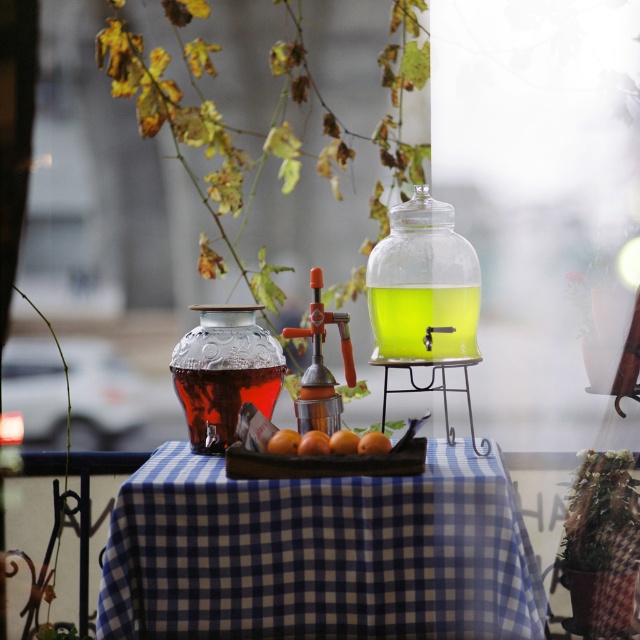
Which is above, blue checkered tablecloth at center or orange matte at center?

orange matte at center

Find the location of a particular element. The image size is (640, 640). blue checkered tablecloth at center is located at coordinates (320, 554).

Does blue checkered tablecloth at center come in front of translucent glass jug at center?

Yes, blue checkered tablecloth at center is in front of translucent glass jug at center.

What do you see at coordinates (320, 554) in the screenshot? I see `blue checkered tablecloth at center` at bounding box center [320, 554].

Locate an element on the screen. Image resolution: width=640 pixels, height=640 pixels. blue checkered tablecloth at center is located at coordinates (320, 554).

Does translucent glass jug at center have a lesser width compared to smooth orange fruit at center?

Yes, translucent glass jug at center is thinner than smooth orange fruit at center.

In the scene shown: Is translucent glass jug at center to the right of smooth orange fruit at center from the viewer's perspective?

Yes, translucent glass jug at center is to the right of smooth orange fruit at center.

Does point (452, 342) come in front of point (304, 435)?

That is False.

The image size is (640, 640). I want to click on translucent glass jug at center, so click(x=422, y=323).